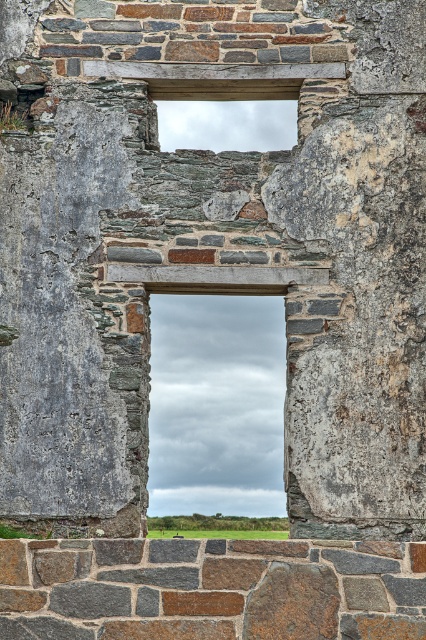
Who is taller, transparent glass window at center or clear glass window at upper center?

transparent glass window at center

Who is more forward, (x=172, y=451) or (x=189, y=134)?

Point (x=189, y=134) is more forward.

Who is more forward, (268, 433) or (284, 109)?

Point (284, 109) is more forward.

You are a GUI agent. You are given a task and a screenshot of the screen. Output one action in this format:
    pyautogui.click(x=<x>, y=<y>)
    Task: Click on the transparent glass window at center
    This screenshot has height=640, width=426.
    Given the screenshot: What is the action you would take?
    pyautogui.click(x=216, y=404)